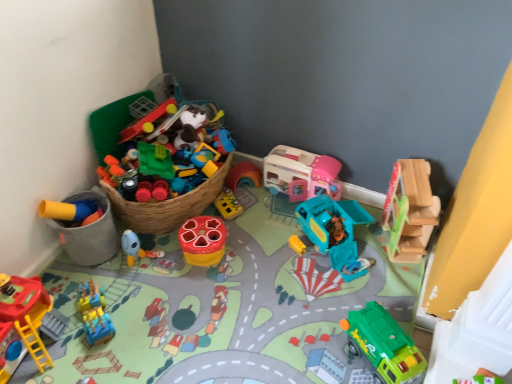
Where is `vacant region to the left of rubberized plastic toy at center, which is counted as the 5th toy, starting from the right`? vacant region to the left of rubberized plastic toy at center, which is counted as the 5th toy, starting from the right is located at coordinates (162, 253).